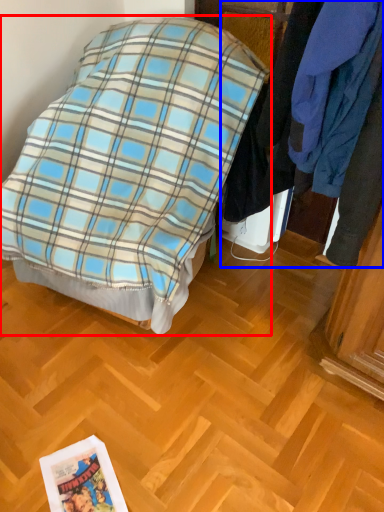
Question: Which point is further to the camera, bed (highlighted by a red box) or closet (highlighted by a blue box)?

Choices:
 (A) bed
 (B) closet

Answer: (A)